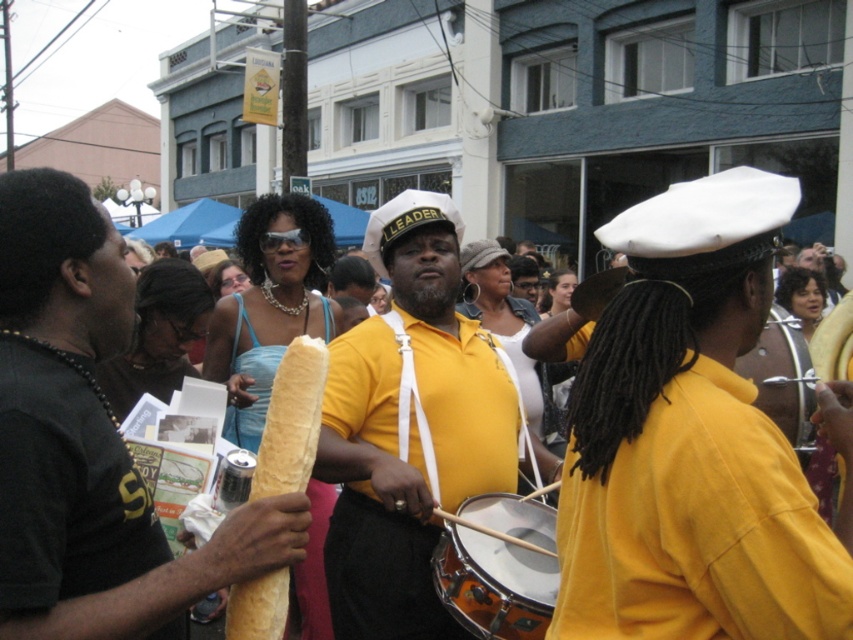
Question: Which point is farther to the camera?

Choices:
 (A) shiny brown drum at center
 (B) yellow matte shirt at center

Answer: (A)

Question: Can you confirm if shiny orange drum at center is positioned to the left of shiny brown drum at center?

Choices:
 (A) yes
 (B) no

Answer: (A)

Question: Which object is closer to the camera taking this photo?

Choices:
 (A) shiny brown drum at center
 (B) yellow matte/satin shirt at center

Answer: (B)

Question: Is yellow matte shirt at center above shiny orange drum at center?

Choices:
 (A) no
 (B) yes

Answer: (B)

Question: Which point is closer to the camera?

Choices:
 (A) shiny brown drum at center
 (B) shiny orange drum at center
 (C) yellow matte shirt at center

Answer: (B)

Question: Is yellow matte shirt at center wider than shiny orange drum at center?

Choices:
 (A) no
 (B) yes

Answer: (B)